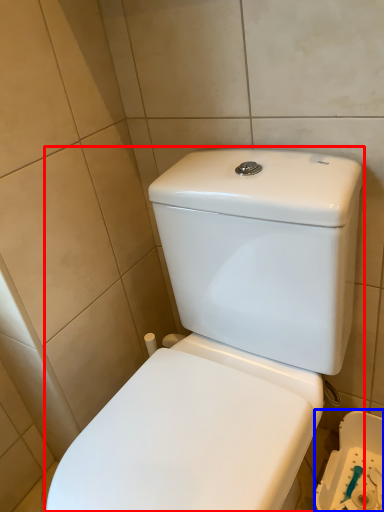
Question: Which of the following is the closest to the observer, toilet (highlighted by a red box) or porcelain (highlighted by a blue box)?

Choices:
 (A) toilet
 (B) porcelain

Answer: (A)